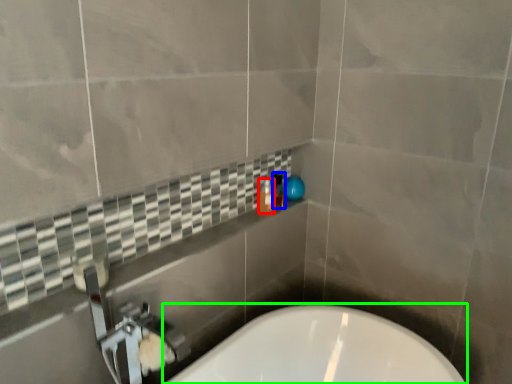
Question: Which object is the closest to the bottle (highlighted by a red box)? Choose among these: toiletry (highlighted by a blue box) or bathtub (highlighted by a green box).

Choices:
 (A) toiletry
 (B) bathtub

Answer: (A)